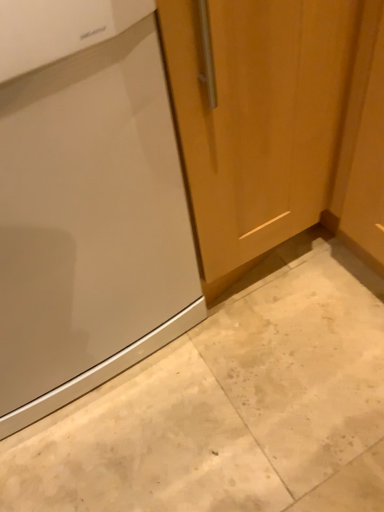
Question: From the image's perspective, is matte wood door at center above satin finish refrigerator at left?

Choices:
 (A) no
 (B) yes

Answer: (B)

Question: Can you confirm if matte wood door at center is smaller than satin finish refrigerator at left?

Choices:
 (A) yes
 (B) no

Answer: (A)

Question: Does matte wood door at center appear on the left side of satin finish refrigerator at left?

Choices:
 (A) no
 (B) yes

Answer: (A)

Question: Can you confirm if matte wood door at center is shorter than satin finish refrigerator at left?

Choices:
 (A) no
 (B) yes

Answer: (B)

Question: From the image's perspective, does matte wood door at center appear lower than satin finish refrigerator at left?

Choices:
 (A) no
 (B) yes

Answer: (A)

Question: From the image's perspective, is satin finish refrigerator at left located above or below matte wood door at center?

Choices:
 (A) above
 (B) below

Answer: (B)

Question: In the image, is satin finish refrigerator at left positioned in front of or behind matte wood door at center?

Choices:
 (A) front
 (B) behind

Answer: (A)

Question: From a real-world perspective, is satin finish refrigerator at left positioned above or below matte wood door at center?

Choices:
 (A) below
 (B) above

Answer: (A)

Question: Is satin finish refrigerator at left inside or outside of matte wood door at center?

Choices:
 (A) outside
 (B) inside

Answer: (A)

Question: Considering the positions of beige marble floor at lower left and satin finish refrigerator at left in the image, is beige marble floor at lower left wider or thinner than satin finish refrigerator at left?

Choices:
 (A) wide
 (B) thin

Answer: (B)

Question: From their relative heights in the image, would you say beige marble floor at lower left is taller or shorter than satin finish refrigerator at left?

Choices:
 (A) tall
 (B) short

Answer: (B)

Question: From a real-world perspective, is beige marble floor at lower left physically located above or below satin finish refrigerator at left?

Choices:
 (A) above
 (B) below

Answer: (B)

Question: Looking at the image, does beige marble floor at lower left seem bigger or smaller compared to satin finish refrigerator at left?

Choices:
 (A) small
 (B) big

Answer: (A)

Question: Considering the relative positions of matte wood door at center and satin finish refrigerator at left in the image provided, is matte wood door at center to the left or to the right of satin finish refrigerator at left?

Choices:
 (A) right
 (B) left

Answer: (A)

Question: In terms of width, does matte wood door at center look wider or thinner when compared to satin finish refrigerator at left?

Choices:
 (A) wide
 (B) thin

Answer: (B)